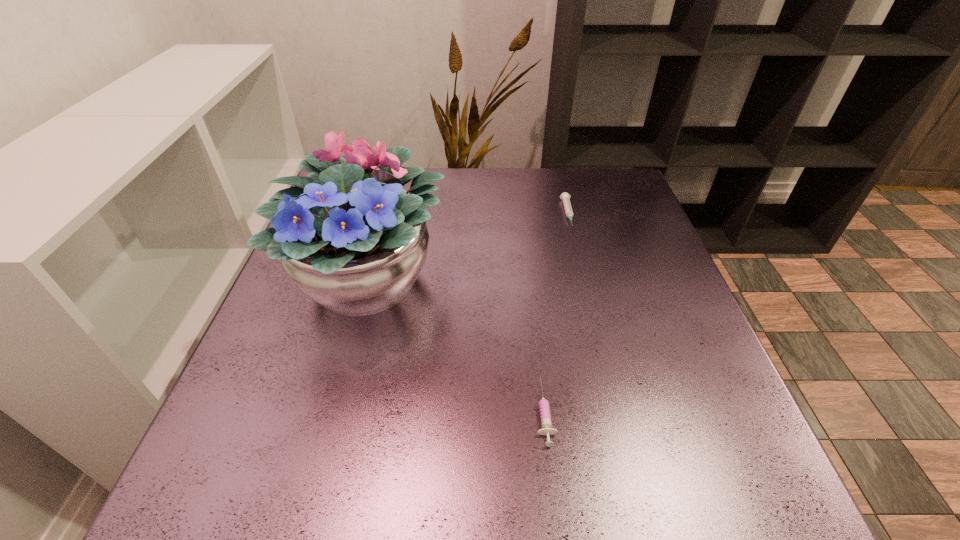
The image size is (960, 540). I want to click on the tallest object, so click(348, 236).

The width and height of the screenshot is (960, 540). In order to click on bouquet in this screenshot , I will do `click(348, 236)`.

Locate an element on the screen. This screenshot has width=960, height=540. the farther syringe is located at coordinates (565, 197).

You are a GUI agent. You are given a task and a screenshot of the screen. Output one action in this format:
    pyautogui.click(x=<x>, y=<y>)
    Task: Click on the rightmost object
    This screenshot has height=540, width=960.
    Given the screenshot: What is the action you would take?
    pyautogui.click(x=565, y=197)

In order to click on the second object from right to left in this screenshot , I will do `click(545, 416)`.

Locate an element on the screen. The height and width of the screenshot is (540, 960). the nearer syringe is located at coordinates (545, 416).

Where is `free space located 0.100m on the right of the leftmost object`? free space located 0.100m on the right of the leftmost object is located at coordinates (493, 281).

The width and height of the screenshot is (960, 540). I want to click on blank space located at the needle end of the rightmost object, so pos(594,316).

Where is `vacant space located 0.260m on the left of the second object from right to left`? The image size is (960, 540). vacant space located 0.260m on the left of the second object from right to left is located at coordinates (378, 411).

In order to click on object positioned at the far edge in this screenshot , I will do `click(565, 197)`.